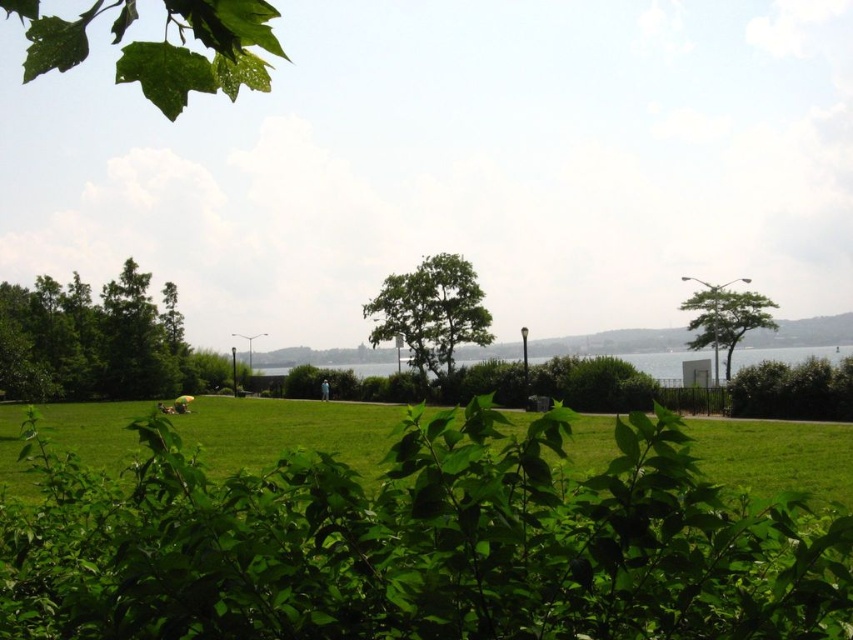
Question: Which point appears closest to the camera in this image?

Choices:
 (A) (845, 416)
 (B) (415, 348)

Answer: (A)

Question: Can you confirm if green leafy bush at center is wider than green leafy tree at left?

Choices:
 (A) no
 (B) yes

Answer: (A)

Question: Which is farther from the green leafy bush at right?

Choices:
 (A) green leafy bush at center
 (B) green leafy tree at right

Answer: (A)

Question: Is green leafy tree at center thinner than green leafy tree at right?

Choices:
 (A) yes
 (B) no

Answer: (B)

Question: Based on their relative distances, which object is nearer to the green leafy tree at right?

Choices:
 (A) green leafy bush at center
 (B) green leafy tree at left
 (C) green leafy tree at center

Answer: (C)

Question: Is green leafy tree at left smaller than green glossy leaf at upper left?

Choices:
 (A) no
 (B) yes

Answer: (B)